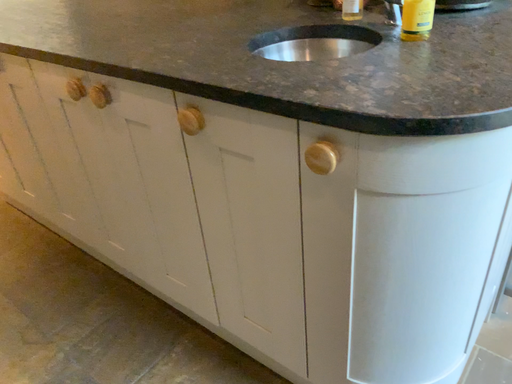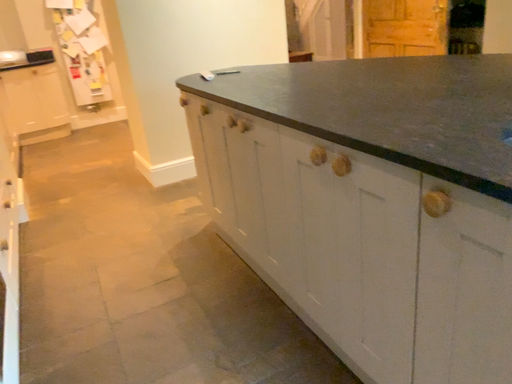
Question: How did the camera likely rotate when shooting the video?

Choices:
 (A) rotated upward
 (B) rotated downward

Answer: (A)